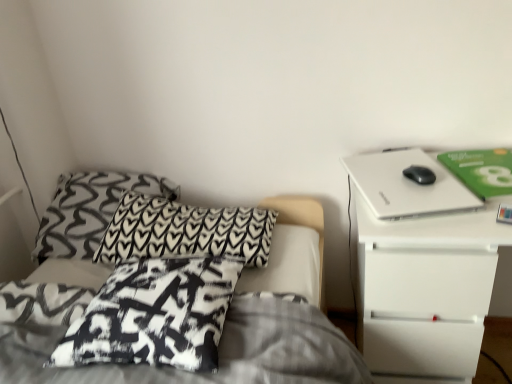
Locate an element on the screen. The height and width of the screenshot is (384, 512). unoccupied space behind black matte mouse at right is located at coordinates (395, 160).